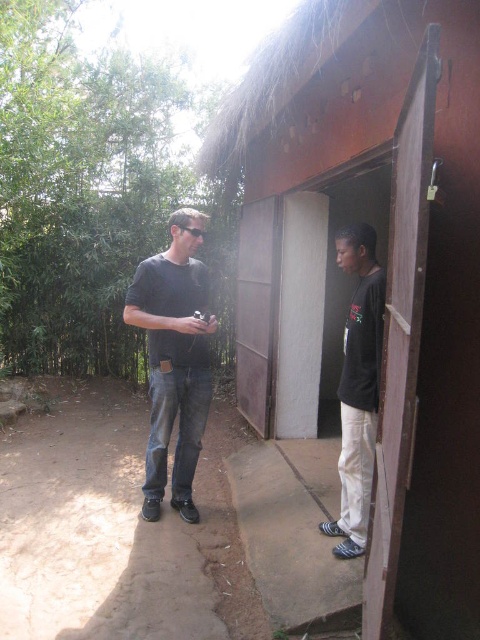
Question: Among these objects, which one is nearest to the camera?

Choices:
 (A) denim jeans at center
 (B) brown wooden hut at center

Answer: (B)

Question: Does denim jeans at center appear on the left side of black matte shirt at center?

Choices:
 (A) yes
 (B) no

Answer: (A)

Question: Is denim jeans at center closer to the viewer compared to black matte shirt at center?

Choices:
 (A) no
 (B) yes

Answer: (A)

Question: Which of the following is the closest to the observer?

Choices:
 (A) brown wooden hut at center
 (B) denim jeans at center

Answer: (A)

Question: Which object is farther from the camera taking this photo?

Choices:
 (A) denim jeans at center
 (B) black matte shirt at center
 (C) brown wooden hut at center

Answer: (A)

Question: Does denim jeans at center have a lesser width compared to black matte shirt at center?

Choices:
 (A) yes
 (B) no

Answer: (B)